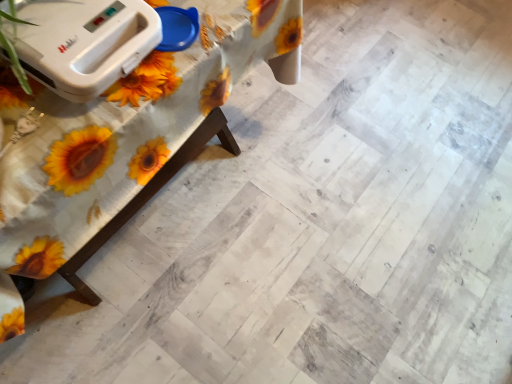
Find the location of a particular element. empty space that is ontop of white plastic toaster at upper left is located at coordinates (67, 23).